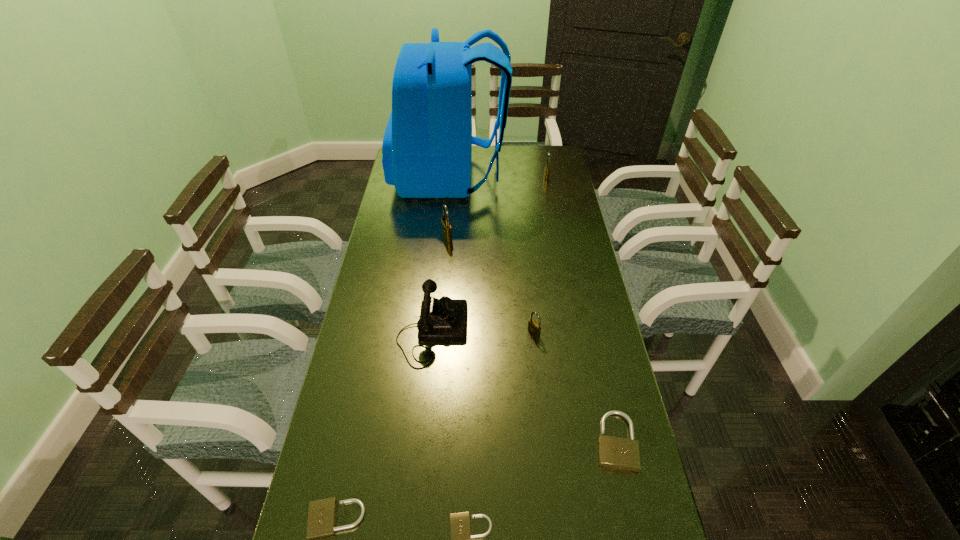
Find the location of a particular element. the third nearest padlock is located at coordinates (619, 453).

This screenshot has height=540, width=960. In order to click on free location located on the back of the backpack in this screenshot , I will do `click(540, 177)`.

The width and height of the screenshot is (960, 540). Identify the location of vacant region located 0.320m on the right of the second tallest object. (538, 238).

The width and height of the screenshot is (960, 540). What are the coordinates of `free space located on the back of the farthest padlock` in the screenshot? It's located at (543, 161).

I want to click on vacant space situated on the front face of the telephone, so click(533, 330).

Image resolution: width=960 pixels, height=540 pixels. Identify the location of free space located 0.060m on the right of the fourth shortest padlock. (560, 333).

Where is `free spot located 0.380m on the back of the farthest beige padlock`? The width and height of the screenshot is (960, 540). free spot located 0.380m on the back of the farthest beige padlock is located at coordinates (585, 303).

Identify the location of object that is at the far edge. point(427,146).

This screenshot has width=960, height=540. In order to click on backpack situated at the left edge in this screenshot , I will do `click(427, 146)`.

Where is `telephone that is at the left edge`? telephone that is at the left edge is located at coordinates (445, 319).